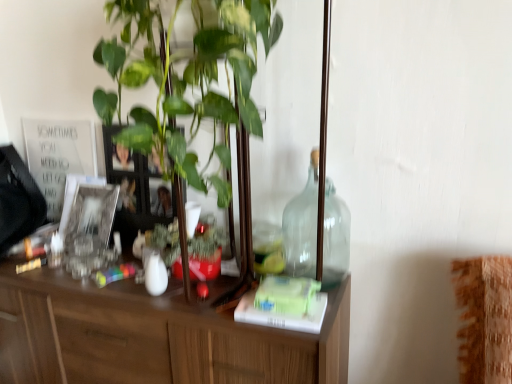
Find the location of a particular element. This screenshot has height=384, width=512. free space above green matte book at center (from a real-world perspective) is located at coordinates (282, 308).